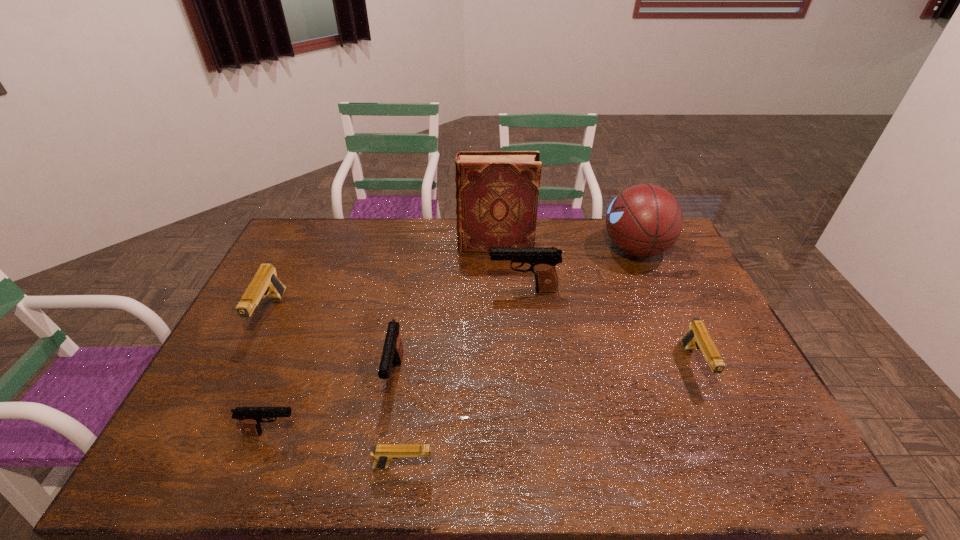
Where is `hardback book`? hardback book is located at coordinates (497, 192).

You are a GUI agent. You are given a task and a screenshot of the screen. Output one action in this format:
    pyautogui.click(x=<x>, y=<y>)
    Task: Click on the basketball
    
    Given the screenshot: What is the action you would take?
    pyautogui.click(x=644, y=220)

You are a GUI agent. You are given a task and a screenshot of the screen. Output one action in this format:
    pyautogui.click(x=<x>, y=<y>)
    Task: Click on the sixth shortest object
    
    Given the screenshot: What is the action you would take?
    pyautogui.click(x=543, y=260)

At what (x,y) coordinates should I click in order to perform the action: click on the biggest black pistol. Please return your answer as a coordinate pair (x, y). Looking at the image, I should click on (543, 260).

This screenshot has width=960, height=540. What are the coordinates of `the leftmost tan pistol` in the screenshot? It's located at (265, 282).

This screenshot has width=960, height=540. I want to click on the leftmost object, so click(265, 282).

Find the location of a particular element. This screenshot has width=960, height=540. the second biggest black pistol is located at coordinates (393, 350).

The width and height of the screenshot is (960, 540). Find the location of `the second black pistol from right to left`. the second black pistol from right to left is located at coordinates (393, 350).

Where is `the rightmost tan pistol`? The image size is (960, 540). the rightmost tan pistol is located at coordinates (697, 336).

Identify the location of the rightmost pistol. This screenshot has width=960, height=540. coord(697,336).